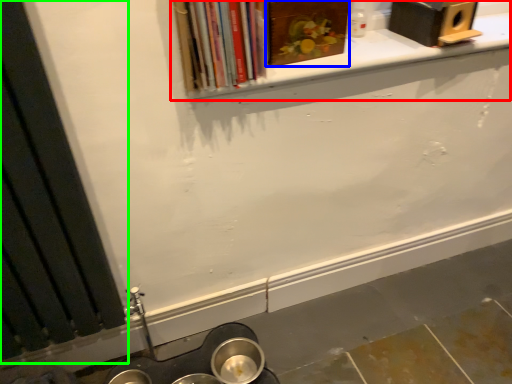
Question: Based on their relative distances, which object is farther from window sill (highlighted by a red box)? Choose from book (highlighted by a blue box) and window frame (highlighted by a green box).

Choices:
 (A) book
 (B) window frame

Answer: (B)